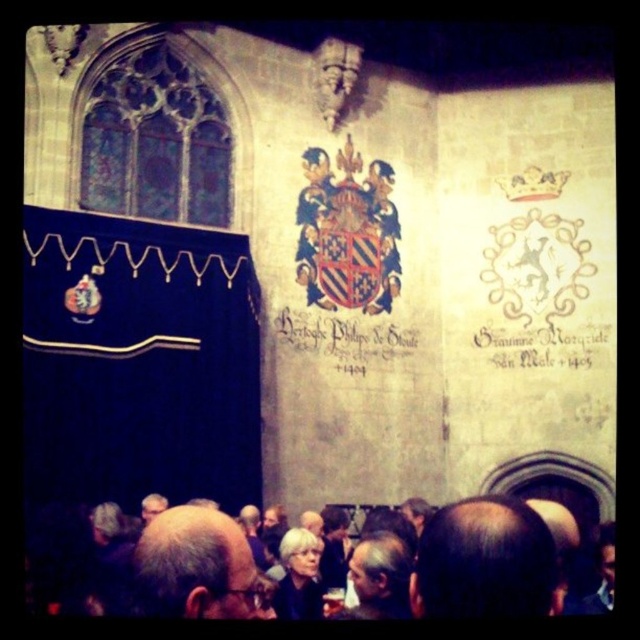
Question: Which object appears farthest from the camera in this image?

Choices:
 (A) gray hair at center
 (B) black paper scroll at center

Answer: (B)

Question: Is gray hair at lower center further to camera compared to black paper scroll at center?

Choices:
 (A) no
 (B) yes

Answer: (A)

Question: Is gray hair at lower center smaller than black paper scroll at center?

Choices:
 (A) yes
 (B) no

Answer: (B)

Question: Which of the following is the farthest from the observer?

Choices:
 (A) (230, 538)
 (B) (324, 348)

Answer: (B)

Question: Does gray hair at lower center have a smaller size compared to gray hair at center?

Choices:
 (A) yes
 (B) no

Answer: (B)

Question: Estimate the real-world distances between objects in this image. Which object is closer to the gray hair at center?

Choices:
 (A) black paper scroll at center
 (B) gray hair at lower center

Answer: (B)